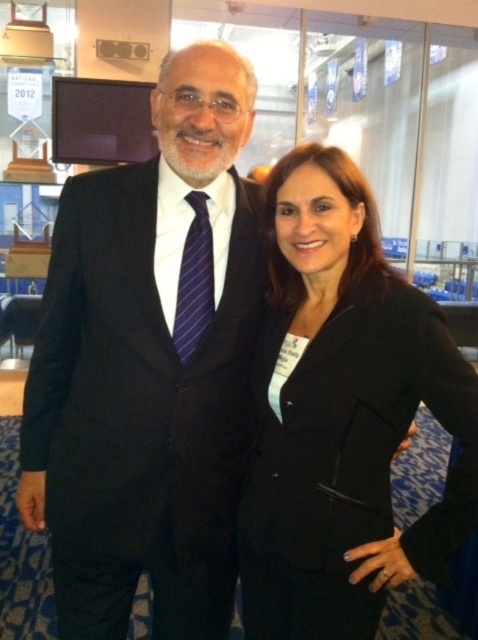
You are attending a formal event and need to introduce yourself to the person wearing the black matte suit at center and the purple striped tie at center. Which person should you approach first if you want to greet the one on the left side of the image?

You should approach the person wearing the black matte suit at center first because it is located to the left of the purple striped tie at center, indicating they are on the left side of the image.